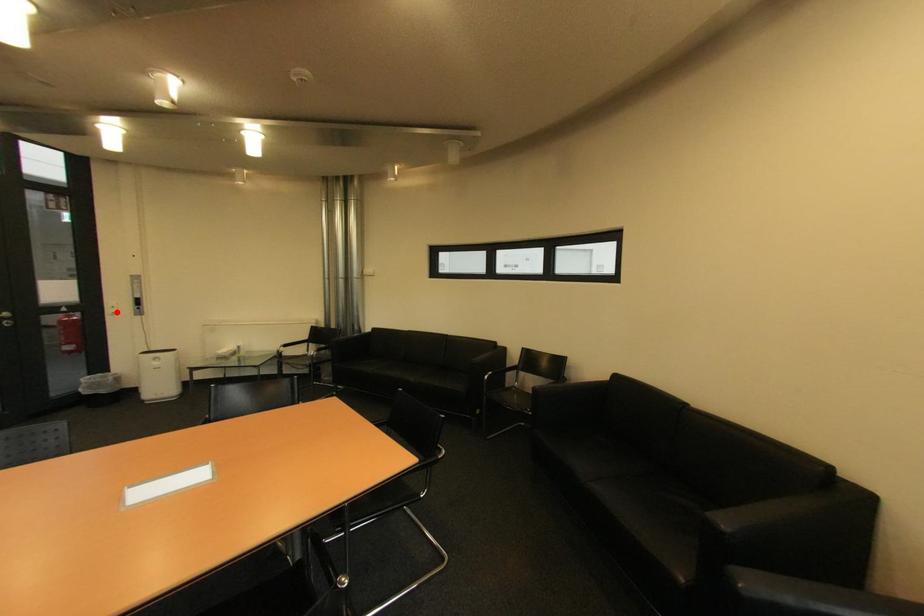
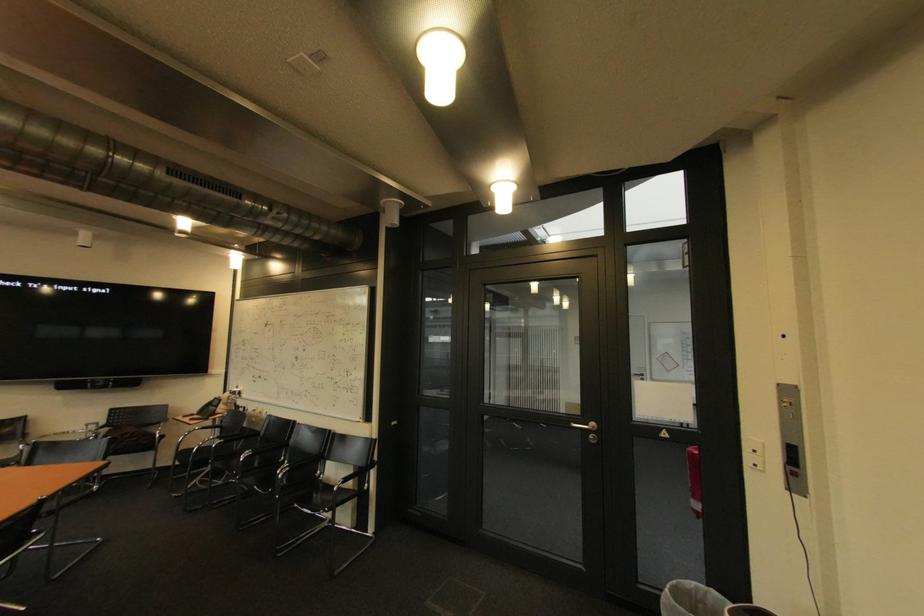
Find the pixel in the second image that matches the highlighted location in the first image.

(757, 459)